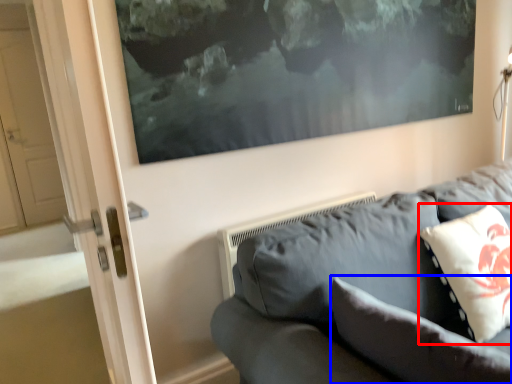
Question: Among these objects, which one is farthest to the camera, pillow (highlighted by a red box) or pillow (highlighted by a blue box)?

Choices:
 (A) pillow
 (B) pillow

Answer: (A)